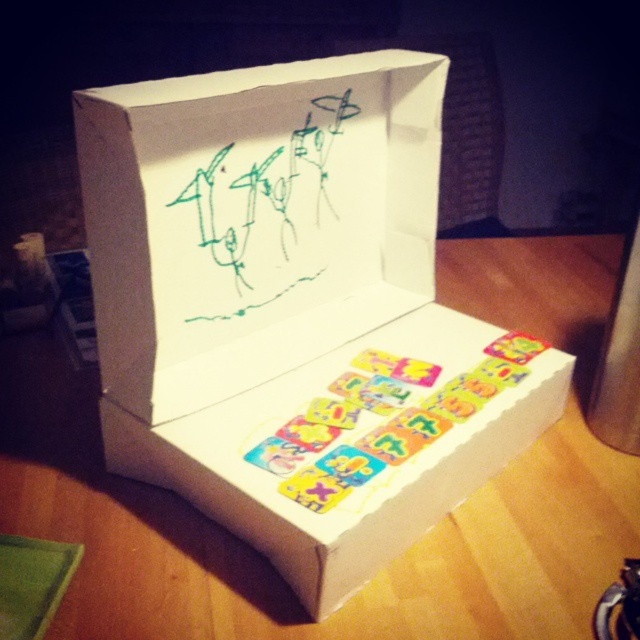
Can you confirm if white cardboard box at center is bigger than green marker drawing at center?

Yes, white cardboard box at center is bigger than green marker drawing at center.

Between white cardboard box at center and green marker drawing at center, which one appears on the left side from the viewer's perspective?

green marker drawing at center

Is point (328, 582) closer to viewer compared to point (224, 141)?

Yes.

This screenshot has width=640, height=640. In order to click on white cardboard box at center in this screenshot , I will do `click(294, 310)`.